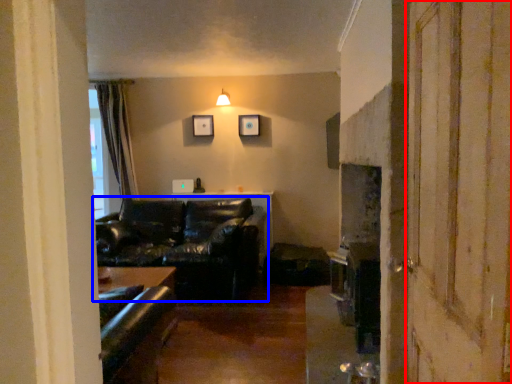
Question: Which point is further to the camera, screen door (highlighted by a red box) or studio couch (highlighted by a blue box)?

Choices:
 (A) screen door
 (B) studio couch

Answer: (B)